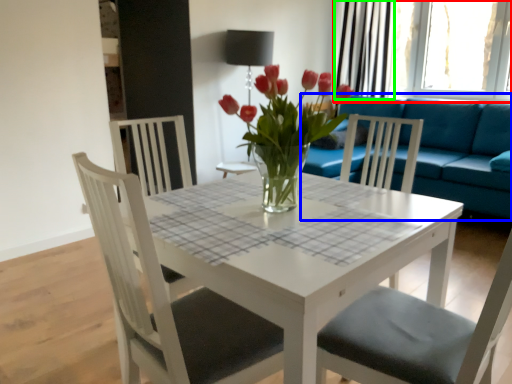
Question: Which object is the closest to the window (highlighted by a red box)? Choose among these: studio couch (highlighted by a blue box) or curtain (highlighted by a green box).

Choices:
 (A) studio couch
 (B) curtain

Answer: (B)